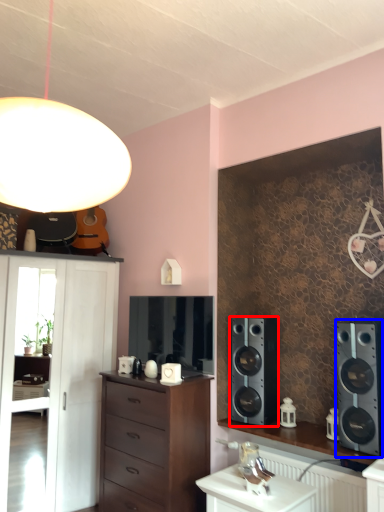
Question: Which of the following is the closest to the observer, speaker (highlighted by a red box) or speaker (highlighted by a blue box)?

Choices:
 (A) speaker
 (B) speaker

Answer: (B)